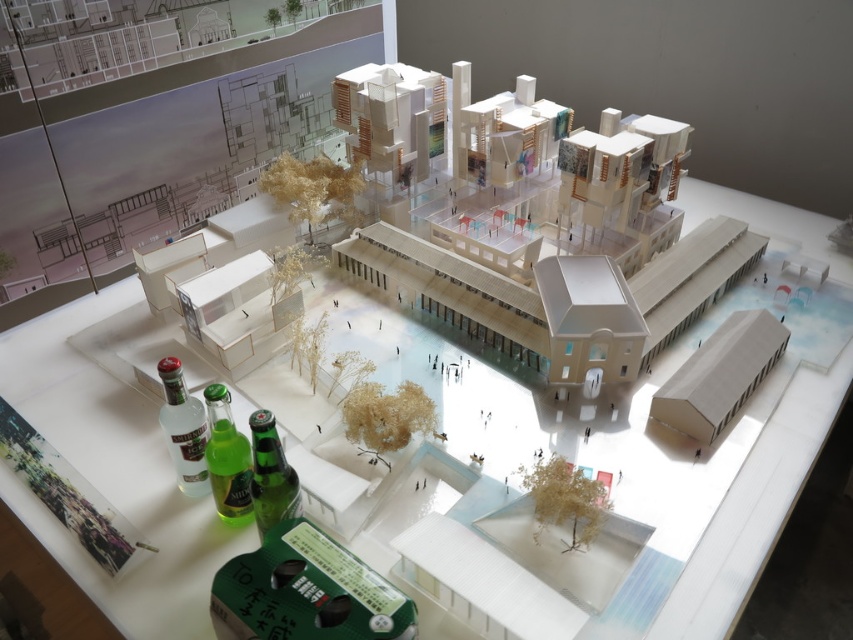
Question: Is white cardboard table at center bigger than green glass bottle at center?

Choices:
 (A) no
 (B) yes

Answer: (B)

Question: Which of the following is the closest to the observer?

Choices:
 (A) green glass bottle at center
 (B) white cardboard table at center
 (C) green glass bottle at lower left
 (D) clear glass bottle at lower left

Answer: (B)

Question: Is clear glass bottle at lower left above green glass bottle at center?

Choices:
 (A) yes
 (B) no

Answer: (A)

Question: Which object is farther from the camera taking this photo?

Choices:
 (A) clear glass bottle at lower left
 (B) green glass bottle at center
 (C) white cardboard table at center
 (D) green matte beer can at center

Answer: (A)

Question: Which of the following is the closest to the observer?

Choices:
 (A) (299, 541)
 (B) (202, 420)
 (C) (426, 378)
 (D) (283, 502)

Answer: (A)

Question: Does white cardboard table at center have a lesser width compared to green matte beer can at center?

Choices:
 (A) no
 (B) yes

Answer: (A)